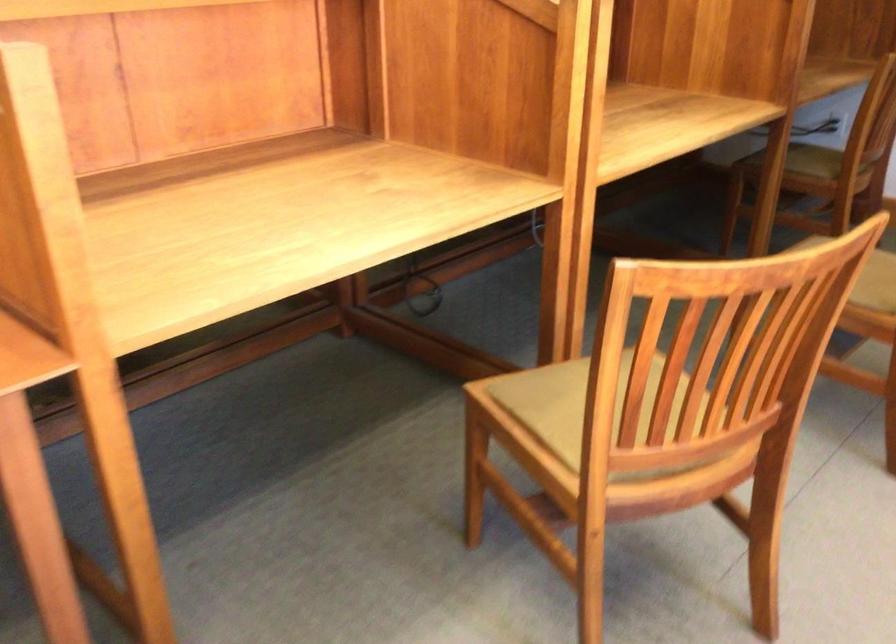
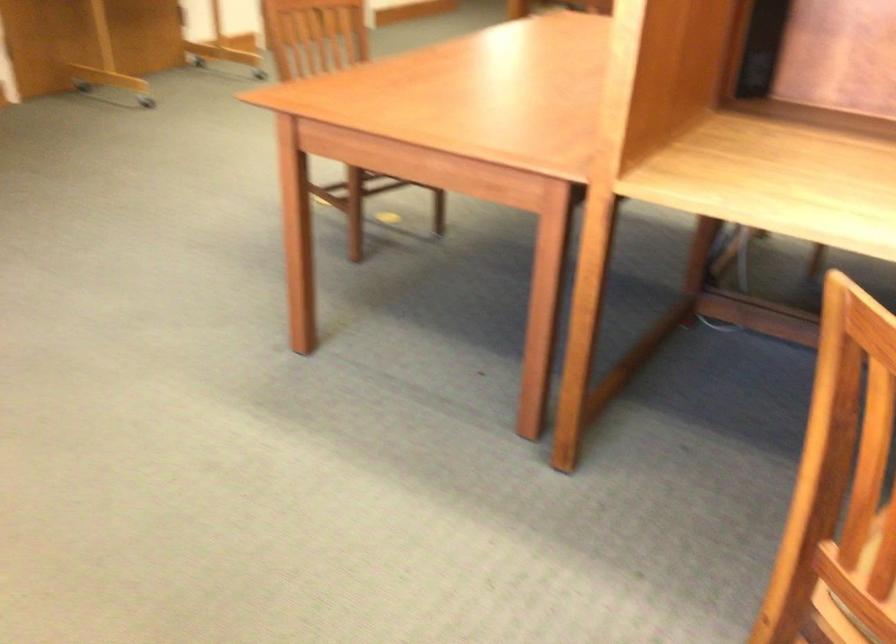
The images are taken continuously from a first-person perspective. In which direction is your viewpoint rotating?

The camera's rotation is toward left-down.